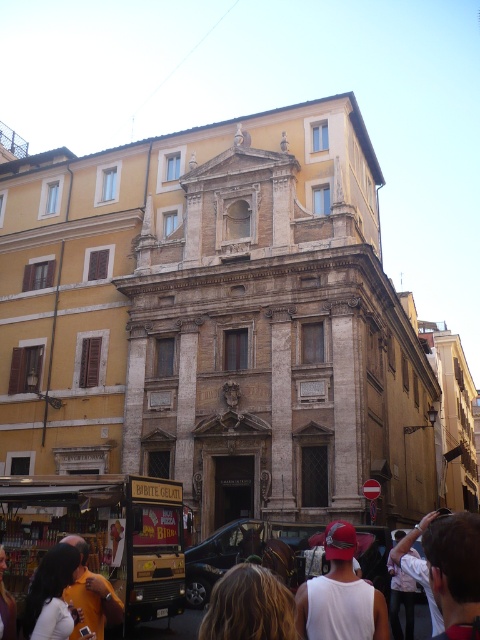
Is white cotton shirt at lower left closer to the viewer compared to yellow fabric shirt at lower left?

No, white cotton shirt at lower left is further to the viewer.

Is white cotton shirt at lower left smaller than yellow fabric shirt at lower left?

Indeed, white cotton shirt at lower left has a smaller size compared to yellow fabric shirt at lower left.

Between point (43, 595) and point (99, 573), which one is positioned in front?

Point (43, 595) is more forward.

At what (x,y) coordinates should I click in order to perform the action: click on white cotton shirt at lower left. Please return your answer as a coordinate pair (x, y). This screenshot has width=480, height=640. Looking at the image, I should click on (51, 595).

Between point (454, 577) and point (110, 605), which one is positioned in front?

Point (454, 577) is in front.

Who is more distant from viewer, [462,554] or [83,627]?

The point [83,627] is more distant.

The width and height of the screenshot is (480, 640). I want to click on dark hair at lower right, so click(455, 572).

Can you confirm if dark hair at lower right is thinner than yellow fabric backpack at lower left?

No.

Is dark hair at lower right in front of yellow fabric backpack at lower left?

That is True.

Where is `dark hair at lower right`? The width and height of the screenshot is (480, 640). dark hair at lower right is located at coordinates (455, 572).